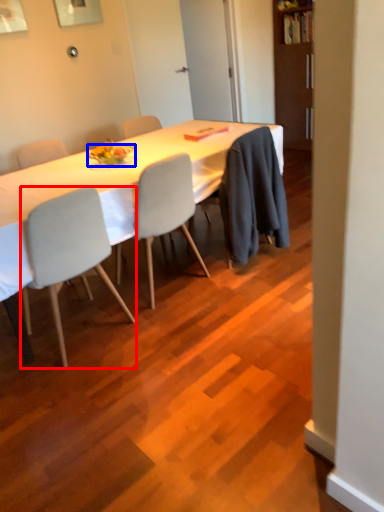
Question: Which object is closer to the camera taking this photo, chair (highlighted by a red box) or plate (highlighted by a blue box)?

Choices:
 (A) chair
 (B) plate

Answer: (A)